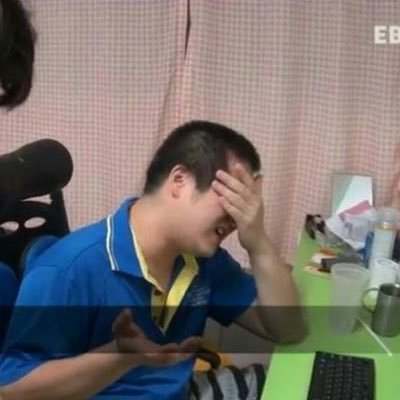
This screenshot has width=400, height=400. I want to click on curtain, so click(x=312, y=124), click(x=82, y=101).